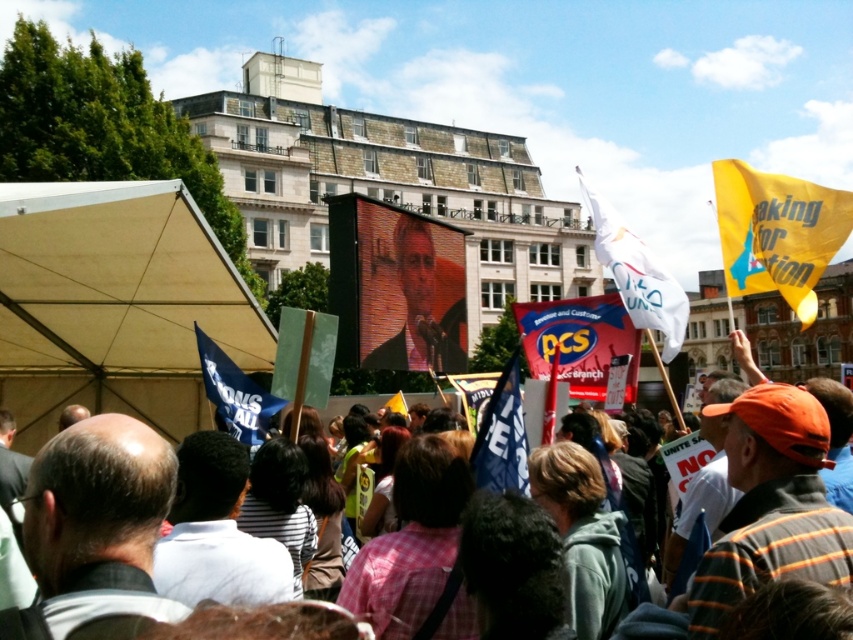
You are a photographer at the protest and want to capture the pink fabric banner at center in your shot. From your current position, where should you aim your camera to ensure the banner is centered in the photo?

You should aim your camera at the coordinates point (579, 340) to center the pink fabric banner at center in your photo.

You are a photographer at the protest and want to capture both the yellow fabric flag at upper right and the pink fabric banner at center in a single shot. However, you notice that one of the flags is blocking the view of the other. Which flag is blocking the other one?

The yellow fabric flag at upper right is in front of the pink fabric banner at center, so it is blocking the view of the pink fabric banner at center.